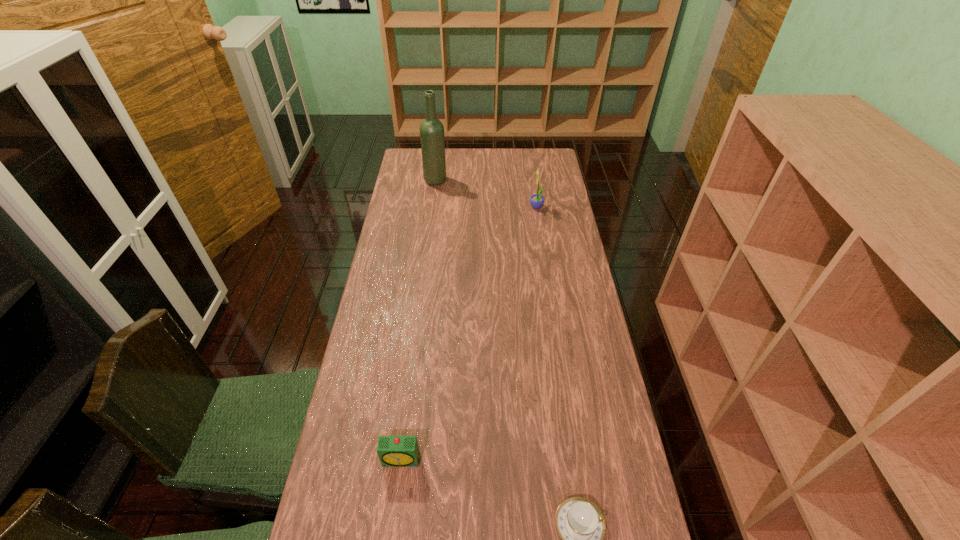
Locate an element on the screen. Image resolution: width=960 pixels, height=540 pixels. the farthest object is located at coordinates (432, 139).

In order to click on wine bottle in this screenshot , I will do `click(432, 139)`.

The width and height of the screenshot is (960, 540). Identify the location of the third nearest object. (536, 200).

This screenshot has height=540, width=960. I want to click on sunflower, so click(536, 200).

Find the location of a particular element. alarm clock is located at coordinates (x=393, y=451).

What are the coordinates of `the third farthest object` in the screenshot? It's located at (393, 451).

Locate an element on the screen. This screenshot has height=540, width=960. vacant space located 0.380m on the front of the tallest object is located at coordinates (428, 242).

Where is `blank area located 0.150m on the front-facing side of the sunflower`? blank area located 0.150m on the front-facing side of the sunflower is located at coordinates (494, 207).

The height and width of the screenshot is (540, 960). What are the coordinates of `vacant area situated 0.170m on the front-facing side of the sunflower` in the screenshot? It's located at (490, 207).

You are a GUI agent. You are given a task and a screenshot of the screen. Output one action in this format:
    pyautogui.click(x=<x>, y=<y>)
    Task: Click on the free region located on the front-facing side of the sunflower
    The width and height of the screenshot is (960, 540).
    Given the screenshot: What is the action you would take?
    pyautogui.click(x=492, y=207)